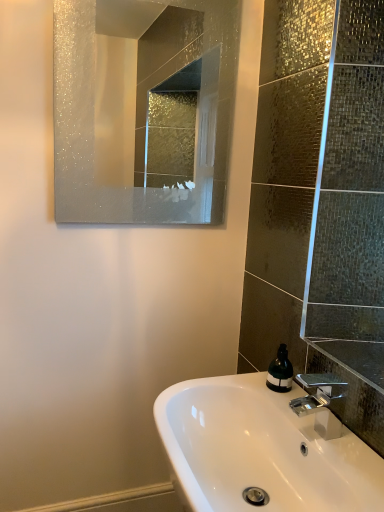
Identify the location of vacant space behind polished chrome faucet at lower right. (282, 406).